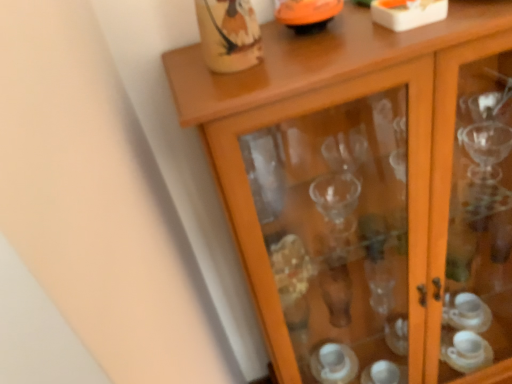
What do you see at coordinates (369, 191) in the screenshot? This screenshot has width=512, height=384. I see `transparent glass cabinet at upper center` at bounding box center [369, 191].

This screenshot has height=384, width=512. I want to click on transparent glass cabinet at upper center, so click(369, 191).

This screenshot has width=512, height=384. What do you see at coordinates (307, 14) in the screenshot?
I see `orange glossy bowl at upper center` at bounding box center [307, 14].

Locate an element on the screen. The width and height of the screenshot is (512, 384). orange glossy bowl at upper center is located at coordinates (307, 14).

The width and height of the screenshot is (512, 384). In order to click on transparent glass cabinet at upper center in this screenshot , I will do `click(369, 191)`.

Considering the positions of objects orange glossy bowl at upper center and transparent glass cabinet at upper center in the image provided, who is more to the right, orange glossy bowl at upper center or transparent glass cabinet at upper center?

From the viewer's perspective, transparent glass cabinet at upper center appears more on the right side.

Is orange glossy bowl at upper center closer to the viewer compared to transparent glass cabinet at upper center?

That is False.

Considering the points (280, 17) and (414, 86), which point is in front, point (280, 17) or point (414, 86)?

The point (414, 86) is more forward.

From the image's perspective, which one is positioned higher, orange glossy bowl at upper center or transparent glass cabinet at upper center?

orange glossy bowl at upper center.

From a real-world perspective, is orange glossy bowl at upper center above or below transparent glass cabinet at upper center?

orange glossy bowl at upper center is situated higher than transparent glass cabinet at upper center in the real world.

Is orange glossy bowl at upper center wider than transparent glass cabinet at upper center?

No, orange glossy bowl at upper center is not wider than transparent glass cabinet at upper center.

Which of these two, orange glossy bowl at upper center or transparent glass cabinet at upper center, stands shorter?

orange glossy bowl at upper center is shorter.

Considering the relative sizes of orange glossy bowl at upper center and transparent glass cabinet at upper center in the image provided, is orange glossy bowl at upper center smaller than transparent glass cabinet at upper center?

Yes, orange glossy bowl at upper center is smaller than transparent glass cabinet at upper center.

Is transparent glass cabinet at upper center inside orange glossy bowl at upper center?

No, transparent glass cabinet at upper center is not a part of orange glossy bowl at upper center.

Is orange glossy bowl at upper center positioned far away from transparent glass cabinet at upper center?

No.

Is orange glossy bowl at upper center turned away from transparent glass cabinet at upper center?

orange glossy bowl at upper center does not have its back to transparent glass cabinet at upper center.

How different are the orientations of orange glossy bowl at upper center and transparent glass cabinet at upper center in degrees?

There is a 0.000677-degree angle between the facing directions of orange glossy bowl at upper center and transparent glass cabinet at upper center.

How much distance is there between orange glossy bowl at upper center and transparent glass cabinet at upper center?

orange glossy bowl at upper center and transparent glass cabinet at upper center are 25.39 inches apart.

You are a GUI agent. You are given a task and a screenshot of the screen. Output one action in this format:
    pyautogui.click(x=<x>, y=<y>)
    Task: Click on the cupboard beneath the orange glossy bowl at upper center (from a real-world perspective)
    The width and height of the screenshot is (512, 384).
    Given the screenshot: What is the action you would take?
    pyautogui.click(x=369, y=191)

Which object is positioned more to the left, transparent glass cabinet at upper center or orange glossy bowl at upper center?

Positioned to the left is orange glossy bowl at upper center.

In the image, is transparent glass cabinet at upper center positioned in front of or behind orange glossy bowl at upper center?

In the image, transparent glass cabinet at upper center appears in front of orange glossy bowl at upper center.

Does point (282, 189) lie in front of point (314, 17)?

No, it is not.

From the image's perspective, which object appears higher, transparent glass cabinet at upper center or orange glossy bowl at upper center?

orange glossy bowl at upper center, from the image's perspective.

From a real-world perspective, which is physically below, transparent glass cabinet at upper center or orange glossy bowl at upper center?

transparent glass cabinet at upper center, from a real-world perspective.

Which object is thinner, transparent glass cabinet at upper center or orange glossy bowl at upper center?

Thinner between the two is orange glossy bowl at upper center.

Which of these two, transparent glass cabinet at upper center or orange glossy bowl at upper center, stands shorter?

orange glossy bowl at upper center.

In the scene shown: Considering the relative sizes of transparent glass cabinet at upper center and orange glossy bowl at upper center in the image provided, is transparent glass cabinet at upper center smaller than orange glossy bowl at upper center?

Actually, transparent glass cabinet at upper center might be larger than orange glossy bowl at upper center.

Is transparent glass cabinet at upper center not within orange glossy bowl at upper center?

Absolutely, transparent glass cabinet at upper center is external to orange glossy bowl at upper center.

Are transparent glass cabinet at upper center and orange glossy bowl at upper center beside each other?

They are not placed beside each other.

Could you tell me if transparent glass cabinet at upper center is facing orange glossy bowl at upper center?

No, transparent glass cabinet at upper center is not oriented towards orange glossy bowl at upper center.

Measure the distance between transparent glass cabinet at upper center and orange glossy bowl at upper center.

transparent glass cabinet at upper center is 25.39 inches from orange glossy bowl at upper center.

This screenshot has width=512, height=384. I want to click on cupboard in front of the orange glossy bowl at upper center, so click(369, 191).

This screenshot has width=512, height=384. I want to click on cupboard located underneath the orange glossy bowl at upper center (from a real-world perspective), so click(x=369, y=191).

This screenshot has width=512, height=384. What are the coordinates of `cupboard in front of the orange glossy bowl at upper center` in the screenshot? It's located at (369, 191).